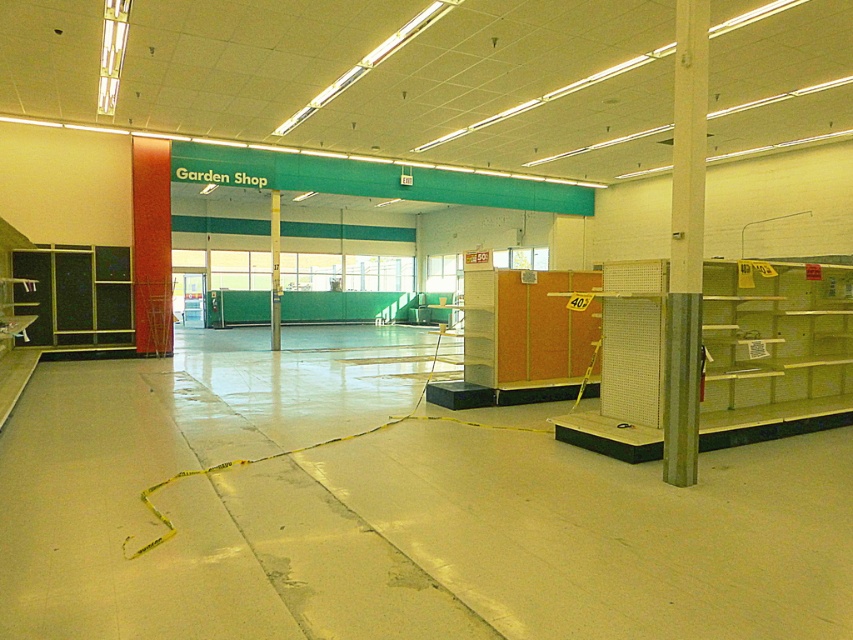
Is metallic pole at center-right bigger than matte black cabinet at left?

No, metallic pole at center-right is not bigger than matte black cabinet at left.

Does metallic pole at center-right have a greater height compared to matte black cabinet at left?

Yes.

Where is `metallic pole at center-right`? This screenshot has width=853, height=640. metallic pole at center-right is located at coordinates (685, 244).

Is metallic pole at center-right taller than green painted wood pillar at center?

In fact, metallic pole at center-right may be shorter than green painted wood pillar at center.

Can you confirm if metallic pole at center-right is smaller than green painted wood pillar at center?

Yes.

Measure the distance between metallic pole at center-right and camera.

A distance of 5.17 meters exists between metallic pole at center-right and camera.

Identify the location of metallic pole at center-right. This screenshot has width=853, height=640. (685, 244).

Is point (128, 289) closer to camera compared to point (274, 195)?

Yes, it is.

Does point (94, 339) come farther from viewer compared to point (276, 333)?

No, it is not.

Where is `matte black cabinet at left`? The image size is (853, 640). matte black cabinet at left is located at coordinates (74, 294).